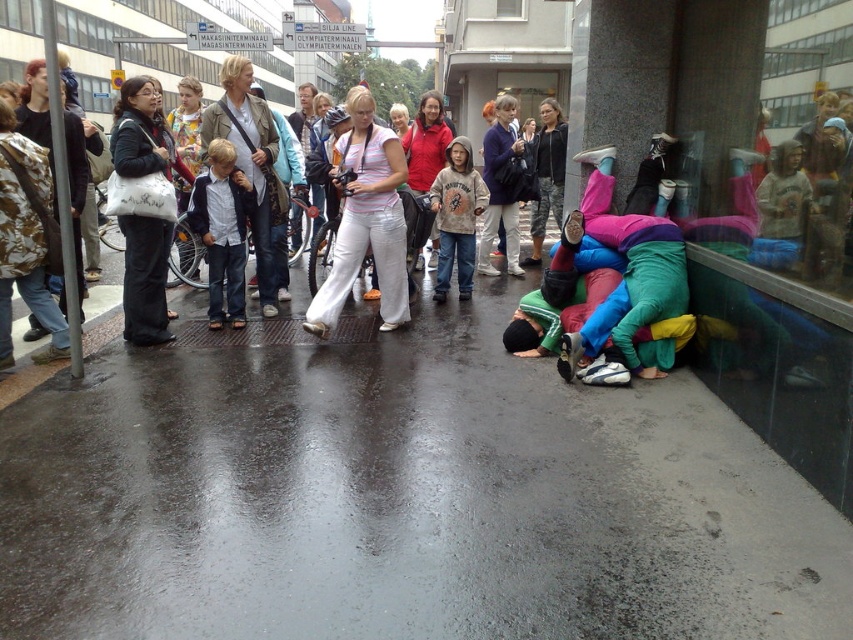
Who is higher up, matte black bag at left or denim jeans at center?

matte black bag at left is higher up.

This screenshot has height=640, width=853. Describe the element at coordinates (144, 280) in the screenshot. I see `matte black bag at left` at that location.

Where is `matte black bag at left`? matte black bag at left is located at coordinates (144, 280).

Between striped cotton shirt at center and denim jeans at center, which one has less height?

With less height is striped cotton shirt at center.

Which is behind, point (352, 99) or point (218, 260)?

Positioned behind is point (218, 260).

Where is `striped cotton shirt at center`? This screenshot has height=640, width=853. striped cotton shirt at center is located at coordinates (366, 220).

Does wet asphalt pavement at lower center have a lesser height compared to striped cotton shirt at center?

Indeed, wet asphalt pavement at lower center has a lesser height compared to striped cotton shirt at center.

Measure the distance between point [180,499] and camera.

They are 10.29 feet apart.

Where is `wet asphalt pavement at lower center`? This screenshot has width=853, height=640. wet asphalt pavement at lower center is located at coordinates (401, 497).